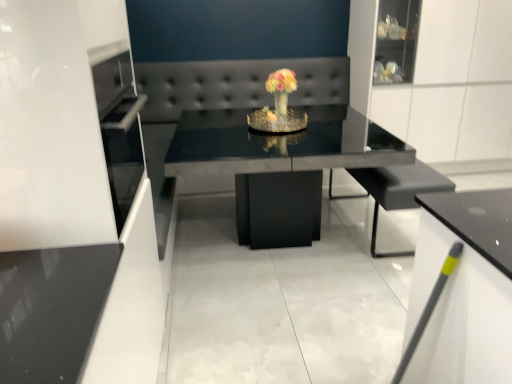
Question: Does black matte armchair at center have a greater width compared to glossy black table at center?

Choices:
 (A) no
 (B) yes

Answer: (A)

Question: Is black matte armchair at center shorter than glossy black table at center?

Choices:
 (A) no
 (B) yes

Answer: (B)

Question: Is black matte armchair at center taller than glossy black table at center?

Choices:
 (A) yes
 (B) no

Answer: (B)

Question: Is black matte armchair at center positioned far away from glossy black table at center?

Choices:
 (A) no
 (B) yes

Answer: (A)

Question: From a real-world perspective, is black matte armchair at center located beneath glossy black table at center?

Choices:
 (A) yes
 (B) no

Answer: (A)

Question: Looking at their shapes, would you say white glossy cabinet at lower right is wider or thinner than black matte armchair at center?

Choices:
 (A) thin
 (B) wide

Answer: (A)

Question: Would you say white glossy cabinet at lower right is to the left or to the right of black matte armchair at center in the picture?

Choices:
 (A) right
 (B) left

Answer: (B)

Question: From a real-world perspective, is white glossy cabinet at lower right above or below black matte armchair at center?

Choices:
 (A) below
 (B) above

Answer: (B)

Question: Considering their positions, is white glossy cabinet at lower right located in front of or behind black matte armchair at center?

Choices:
 (A) behind
 (B) front

Answer: (B)

Question: Would you say glossy black table at center is inside or outside black matte armchair at center?

Choices:
 (A) outside
 (B) inside

Answer: (A)

Question: From the image's perspective, is glossy black table at center positioned above or below black matte armchair at center?

Choices:
 (A) below
 (B) above

Answer: (B)

Question: From a real-world perspective, relative to black matte armchair at center, is glossy black table at center vertically above or below?

Choices:
 (A) above
 (B) below

Answer: (A)

Question: Considering the positions of glossy black table at center and black matte armchair at center in the image, is glossy black table at center taller or shorter than black matte armchair at center?

Choices:
 (A) short
 (B) tall

Answer: (B)

Question: From the image's perspective, is black matte armchair at center located above or below glossy black table at center?

Choices:
 (A) above
 (B) below

Answer: (B)

Question: From a real-world perspective, is black matte armchair at center physically located above or below glossy black table at center?

Choices:
 (A) above
 (B) below

Answer: (B)